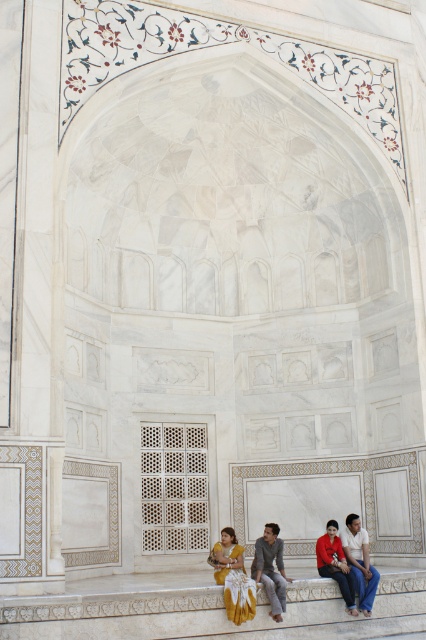
Question: Which point appears closest to the camera in this image?

Choices:
 (A) (258, 570)
 (B) (241, 566)

Answer: (A)

Question: Considering the relative positions of white marble ledge at lower center and matte red shirt at lower right in the image provided, where is white marble ledge at lower center located with respect to matte red shirt at lower right?

Choices:
 (A) left
 (B) right

Answer: (A)

Question: Is white marble person at lower right bigger than matte red shirt at lower right?

Choices:
 (A) yes
 (B) no

Answer: (B)

Question: Which object is closer to the camera taking this photo?

Choices:
 (A) white marble ledge at lower center
 (B) matte red shirt at lower right
 (C) satin yellow sari at lower center

Answer: (A)

Question: Can you confirm if white marble ledge at lower center is wider than matte red shirt at lower right?

Choices:
 (A) no
 (B) yes

Answer: (B)

Question: Which of the following is the closest to the observer?

Choices:
 (A) light gray fabric pants at center
 (B) white marble ledge at lower center

Answer: (B)